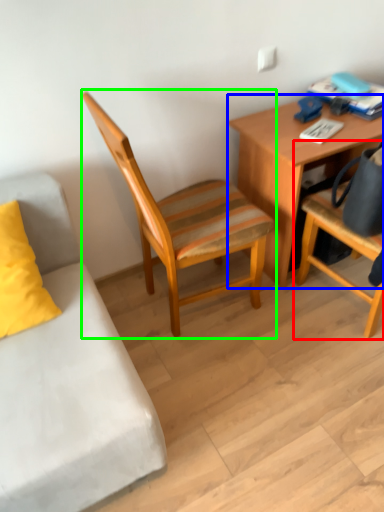
Question: Which object is positioned closest to chair (highlighted by a red box)? Select from desk (highlighted by a blue box) and chair (highlighted by a green box).

Choices:
 (A) desk
 (B) chair

Answer: (A)